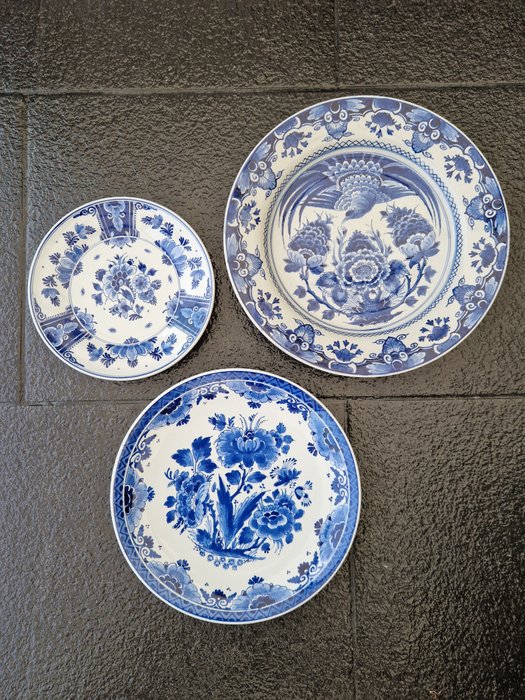
This screenshot has width=525, height=700. Identify the location of grout. (363, 409).